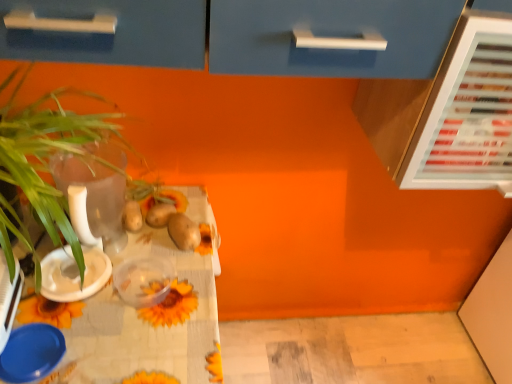
Question: Should I look upward or downward to see translucent plastic container at center, which is the second tableware from top to bottom?

Choices:
 (A) up
 (B) down

Answer: (B)

Question: Is transparent glass vase at left outside blue plastic lid at lower left, which is the 1th tableware in bottom-to-top order?

Choices:
 (A) yes
 (B) no

Answer: (A)

Question: Is transparent glass vase at left thinner than blue plastic lid at lower left, which is the 1th tableware in bottom-to-top order?

Choices:
 (A) yes
 (B) no

Answer: (B)

Question: Can you confirm if transparent glass vase at left is positioned to the left of blue plastic lid at lower left, positioned as the 3th tableware in top-to-bottom order?

Choices:
 (A) yes
 (B) no

Answer: (B)

Question: Is transparent glass vase at left aimed at blue plastic lid at lower left, positioned as the 3th tableware in top-to-bottom order?

Choices:
 (A) no
 (B) yes

Answer: (A)

Question: Is transparent glass vase at left smaller than blue plastic lid at lower left, positioned as the 3th tableware in top-to-bottom order?

Choices:
 (A) no
 (B) yes

Answer: (A)

Question: Considering the relative sizes of transparent glass vase at left and blue plastic lid at lower left, which is the 1th tableware in bottom-to-top order, in the image provided, is transparent glass vase at left shorter than blue plastic lid at lower left, which is the 1th tableware in bottom-to-top order,?

Choices:
 (A) no
 (B) yes

Answer: (A)

Question: Is green leafy plant at left aimed at sunflower-patterned tablecloth at lower left?

Choices:
 (A) yes
 (B) no

Answer: (B)

Question: From a real-world perspective, is green leafy plant at left beneath sunflower-patterned tablecloth at lower left?

Choices:
 (A) yes
 (B) no

Answer: (B)

Question: Is green leafy plant at left closer to the viewer compared to sunflower-patterned tablecloth at lower left?

Choices:
 (A) yes
 (B) no

Answer: (A)

Question: Is green leafy plant at left at the left side of sunflower-patterned tablecloth at lower left?

Choices:
 (A) yes
 (B) no

Answer: (B)

Question: Considering the relative sizes of green leafy plant at left and sunflower-patterned tablecloth at lower left in the image provided, is green leafy plant at left bigger than sunflower-patterned tablecloth at lower left?

Choices:
 (A) no
 (B) yes

Answer: (A)

Question: Is green leafy plant at left outside sunflower-patterned tablecloth at lower left?

Choices:
 (A) no
 (B) yes

Answer: (B)

Question: Considering the relative positions of blue plastic bowl at lower left and translucent plastic container at center, which is the second tableware from top to bottom, in the image provided, is blue plastic bowl at lower left to the right of translucent plastic container at center, which is the second tableware from top to bottom, from the viewer's perspective?

Choices:
 (A) yes
 (B) no

Answer: (B)